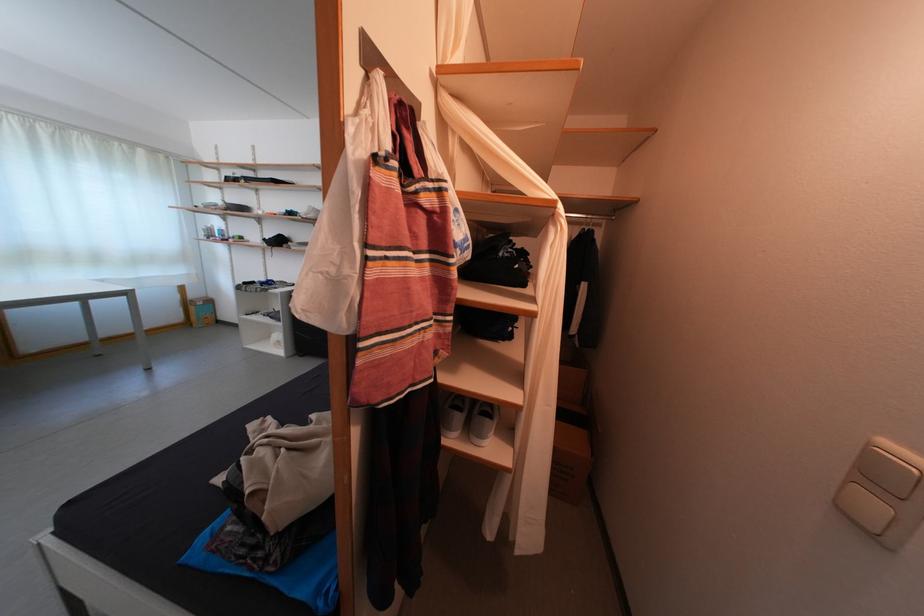
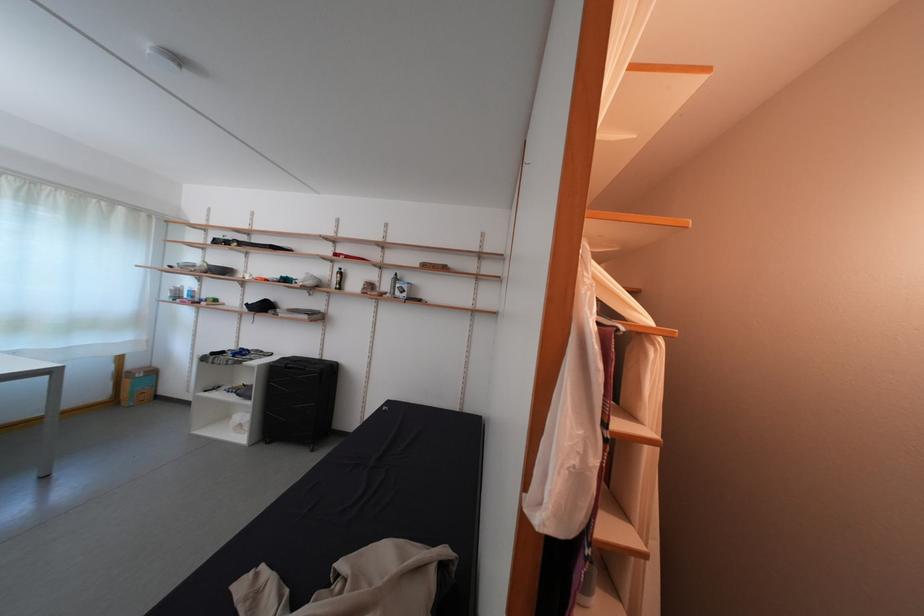
In the second image, find the point that corresponds to [201,302] in the first image.

(140, 371)